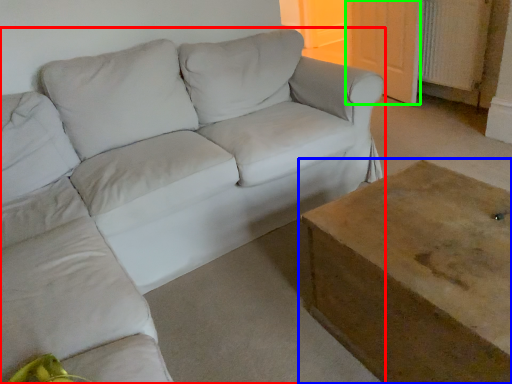
Question: Considering the real-world distances, which object is farthest from studio couch (highlighted by a red box)? table (highlighted by a blue box) or door (highlighted by a green box)?

Choices:
 (A) table
 (B) door

Answer: (B)